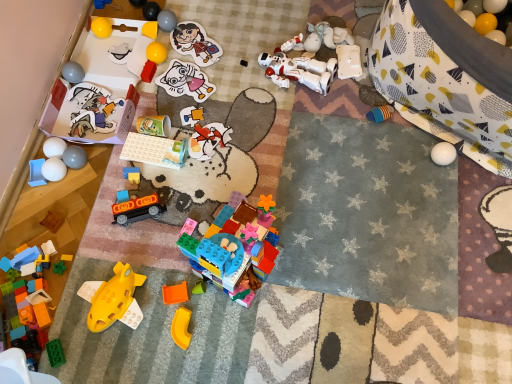
Locate an element on the screen. blank space to the left of white plastic remote control at upper center, which is the second toy from right to left is located at coordinates (280, 81).